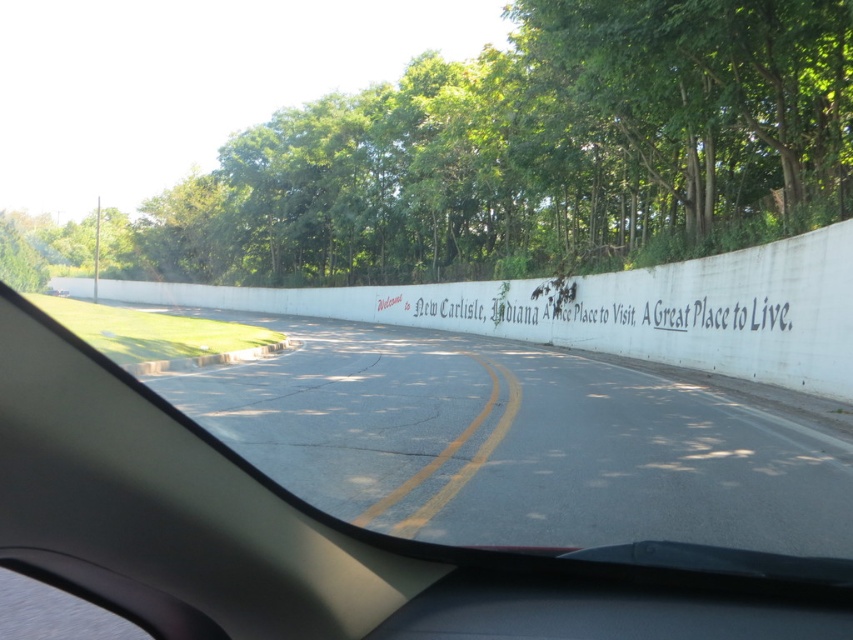
Can you confirm if white concrete wall at center is bigger than white painted text at center?

Incorrect, white concrete wall at center is not larger than white painted text at center.

Consider the image. Is white concrete wall at center below white painted text at center?

Yes.

The height and width of the screenshot is (640, 853). What are the coordinates of `white concrete wall at center` in the screenshot? It's located at (317, 536).

Which is behind, point (567, 141) or point (131, 476)?

Point (567, 141)

Find the location of a particular element. The height and width of the screenshot is (640, 853). green leafy trees at upper center is located at coordinates (532, 154).

Is green leafy trees at upper center below white painted text at center?

Incorrect, green leafy trees at upper center is not positioned below white painted text at center.

Which is more to the right, green leafy trees at upper center or white painted text at center?

white painted text at center is more to the right.

Is point (741, 17) farther from camera compared to point (775, 312)?

No, it is in front of (775, 312).

This screenshot has height=640, width=853. I want to click on green leafy trees at upper center, so click(x=532, y=154).